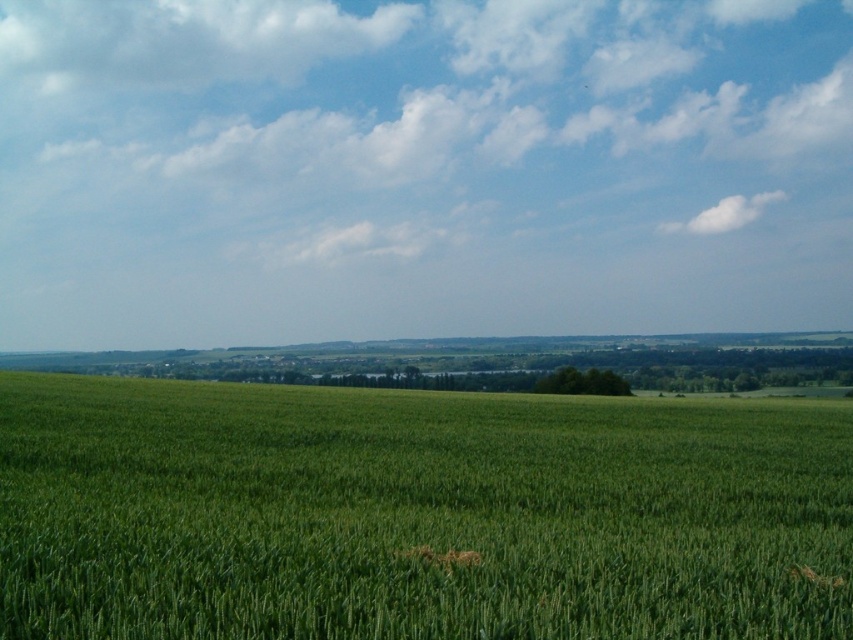
Question: Observing the image, what is the correct spatial positioning of green grassy field at center in reference to white fluffy cloud at upper right?

Choices:
 (A) below
 (B) above

Answer: (A)

Question: Is blue sky at upper center positioned before green grassy field at center?

Choices:
 (A) no
 (B) yes

Answer: (A)

Question: Does blue sky at upper center come behind white fluffy cloud at upper right?

Choices:
 (A) no
 (B) yes

Answer: (A)

Question: Which point is farther to the camera?

Choices:
 (A) green grassy field at center
 (B) white fluffy cloud at upper right
 (C) white fluffy cloud at upper center

Answer: (C)

Question: Estimate the real-world distances between objects in this image. Which object is farther from the white fluffy cloud at upper right?

Choices:
 (A) blue sky at upper center
 (B) green grassy field at center

Answer: (B)

Question: Which point is closer to the camera?

Choices:
 (A) white fluffy cloud at upper center
 (B) green grassy field at center
 (C) white fluffy cloud at upper right
 (D) blue sky at upper center

Answer: (B)